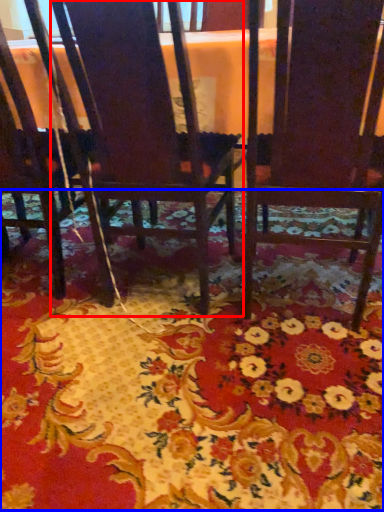
Question: Which of the following is the closest to the observer, chair (highlighted by a red box) or mat (highlighted by a blue box)?

Choices:
 (A) chair
 (B) mat

Answer: (B)